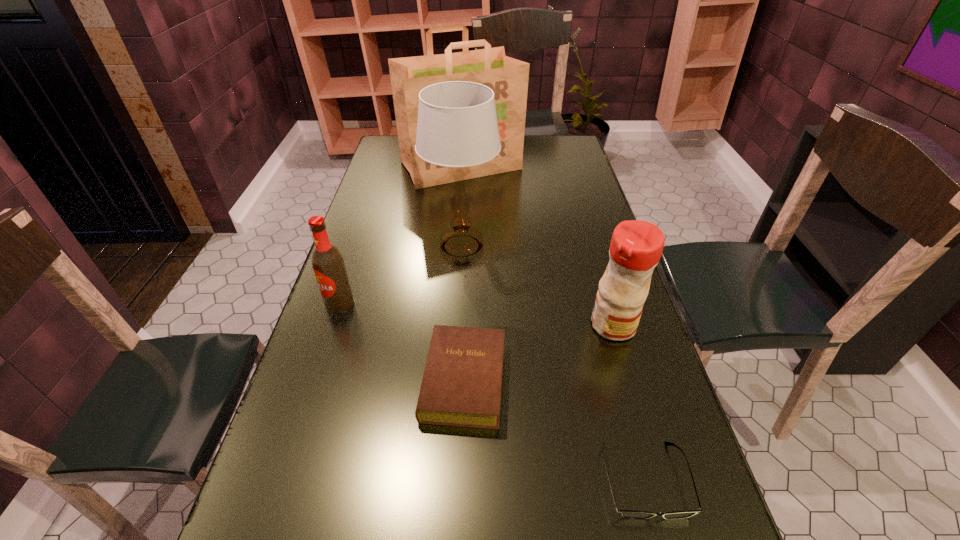
Locate an element on the screen. the closest object to the second shortest object is located at coordinates (631, 514).

Locate which object ranks fourth in proximity to the beer bottle. Please provide its 2D coordinates. Your answer should be formatted as a tuple, i.e. [(x, y)], where the tuple contains the x and y coordinates of a point satisfying the conditions above.

[(636, 246)]

Locate an element on the screen. The height and width of the screenshot is (540, 960). free space in the image that satisfies the following two spatial constraints: 1. on the front-facing side of the condiment; 2. on the left side of the table lamp is located at coordinates (458, 326).